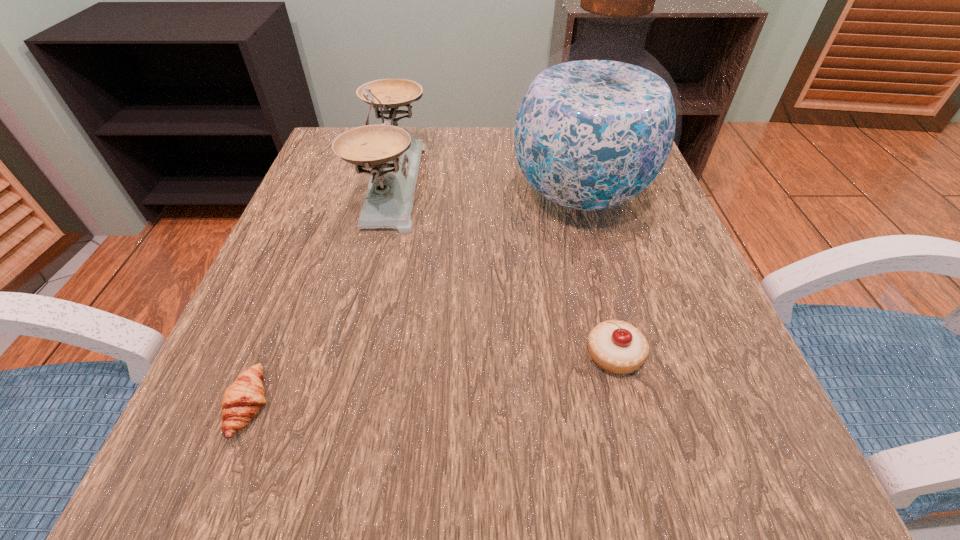
Where is `object at the far right corner`? Image resolution: width=960 pixels, height=540 pixels. object at the far right corner is located at coordinates (595, 127).

Locate an element on the screen. The width and height of the screenshot is (960, 540). free spot at the far edge of the desktop is located at coordinates (471, 135).

Locate an element on the screen. This screenshot has width=960, height=540. vacant space at the near edge of the desktop is located at coordinates (484, 510).

Where is `vacant point at the left edge`? The height and width of the screenshot is (540, 960). vacant point at the left edge is located at coordinates (278, 389).

The height and width of the screenshot is (540, 960). Find the location of `vacant area at the right edge`. vacant area at the right edge is located at coordinates (613, 309).

The image size is (960, 540). I want to click on vacant space at the far left corner of the desktop, so click(324, 172).

In the image, there is a desktop. What are the coordinates of `free space at the near left corner` in the screenshot? It's located at click(224, 449).

In the image, there is a desktop. Where is `free region at the near right corner`? free region at the near right corner is located at coordinates (697, 487).

This screenshot has width=960, height=540. I want to click on free space between the scale and the water jug, so click(487, 190).

This screenshot has height=540, width=960. In order to click on vacant area that lies between the taller pastry and the second object from left to right in this screenshot , I will do `click(504, 269)`.